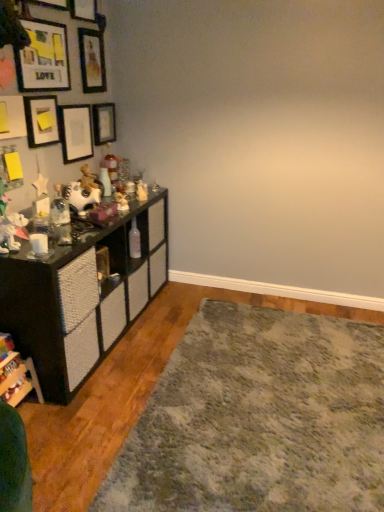
Question: Is wooden bookshelf at lower left, the 2th shelf in the back-to-front sequence, in front of or behind wooden picture frame at upper left, positioned as the 3th picture frame in top-to-bottom order, in the image?

Choices:
 (A) behind
 (B) front

Answer: (B)

Question: Considering the relative positions of wooden bookshelf at lower left, the 2th shelf in the back-to-front sequence, and wooden picture frame at upper left, placed as the 4th picture frame when sorted from bottom to top, in the image provided, is wooden bookshelf at lower left, the 2th shelf in the back-to-front sequence, to the left or to the right of wooden picture frame at upper left, placed as the 4th picture frame when sorted from bottom to top,?

Choices:
 (A) left
 (B) right

Answer: (A)

Question: Which object is the closest to the yellow paper at upper left, acting as the sixth picture frame starting from the top?

Choices:
 (A) black textured cabinet at left, the 1th shelf in the back-to-front sequence
 (B) matte black picture frame at upper left, the 5th picture frame positioned from the bottom
 (C) wooden bookshelf at lower left, the 2th shelf in the back-to-front sequence
 (D) wooden picture frame at upper left, which is the sixth picture frame in bottom-to-top order
 (E) matte black picture frame at upper center, which is the third picture frame in bottom-to-top order

Answer: (B)

Question: Based on their relative distances, which object is nearer to the wooden bookshelf at lower left, the 2th shelf in the back-to-front sequence?

Choices:
 (A) wooden picture frame at upper left, the 1th picture frame when ordered from top to bottom
 (B) matte black picture frame at upper left, the 5th picture frame positioned from the bottom
 (C) shaggy gray rug at lower right
 (D) matte black picture frame at upper center, which ranks as the fourth picture frame in top-to-bottom order
 (E) black textured cabinet at left, acting as the second shelf starting from the front

Answer: (E)